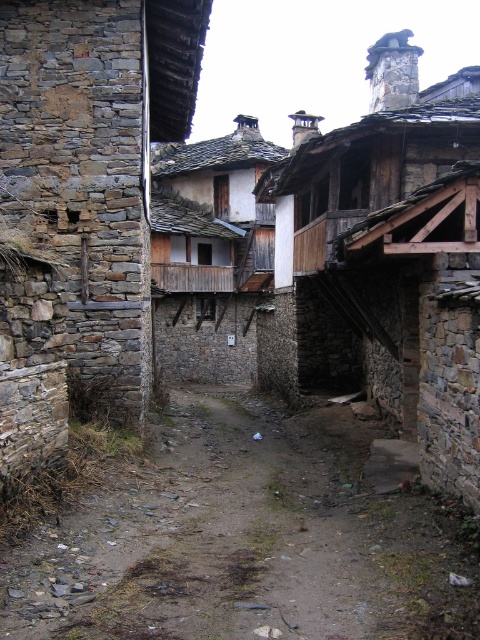
Question: Can you confirm if rustic stone hut at left is positioned to the right of wooden balcony at upper right?

Choices:
 (A) yes
 (B) no

Answer: (B)

Question: Can you confirm if rustic stone hut at left is positioned to the right of wooden planks at center?

Choices:
 (A) no
 (B) yes

Answer: (A)

Question: Among these points, which one is farthest from the camera?

Choices:
 (A) (357, 275)
 (B) (135, 332)
 (C) (197, 163)
 (D) (149, 451)

Answer: (C)

Question: Estimate the real-world distances between objects in this image. Which object is farther from the dirt ground at center?

Choices:
 (A) wooden planks at center
 (B) rustic stone hut at left

Answer: (A)

Question: Is dirt ground at center closer to the viewer compared to wooden planks at center?

Choices:
 (A) yes
 (B) no

Answer: (A)

Question: Among these objects, which one is nearest to the camera?

Choices:
 (A) dirt ground at center
 (B) wooden balcony at upper right
 (C) wooden planks at center
 (D) rustic stone hut at left

Answer: (A)